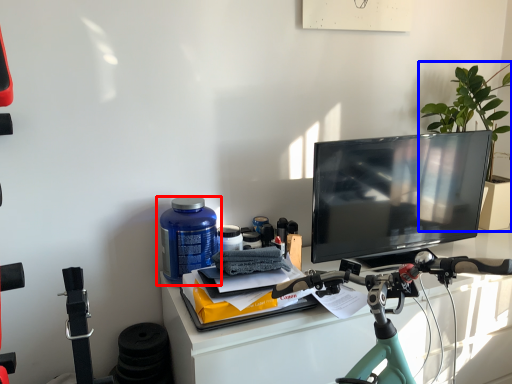
Question: Which point is further to the camera, bottle (highlighted by a red box) or houseplant (highlighted by a blue box)?

Choices:
 (A) bottle
 (B) houseplant

Answer: (B)